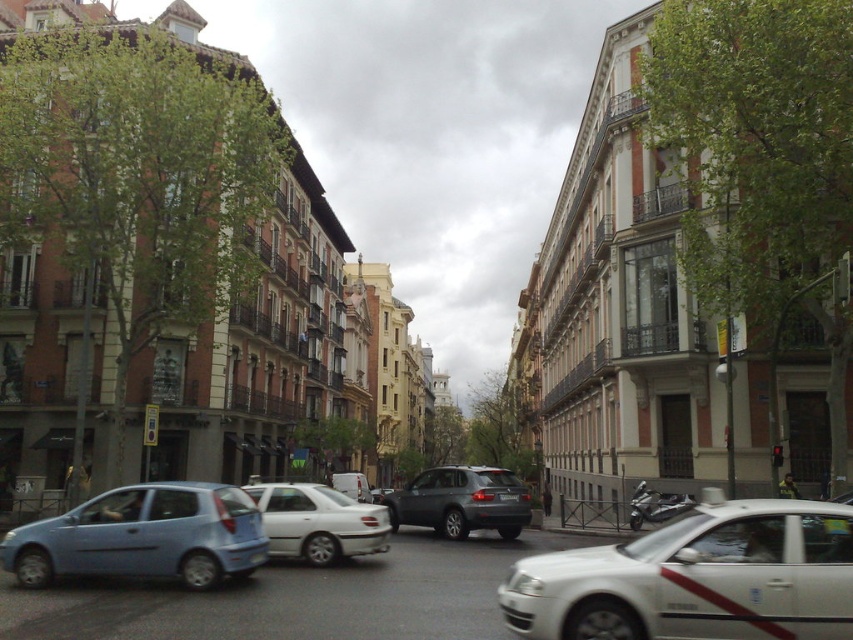
Question: Is metallic gray suv at center wider than white matte van at center?

Choices:
 (A) no
 (B) yes

Answer: (B)

Question: Which point is farther to the camera?

Choices:
 (A) (172, 561)
 (B) (350, 477)
 (C) (381, 502)

Answer: (B)

Question: Which point is farther from the camera taking this photo?

Choices:
 (A) (350, 484)
 (B) (242, 545)
 (C) (624, 580)

Answer: (A)

Question: Does matte blue hatchback at left have a smaller size compared to white matte van at center?

Choices:
 (A) no
 (B) yes

Answer: (A)

Question: Based on their relative distances, which object is nearer to the metallic gray suv at center?

Choices:
 (A) white matte sedan at center
 (B) white matte taxi at center
 (C) white matte van at center
 (D) matte blue hatchback at left

Answer: (A)

Question: Is white matte taxi at center positioned at the back of white matte sedan at center?

Choices:
 (A) no
 (B) yes

Answer: (A)